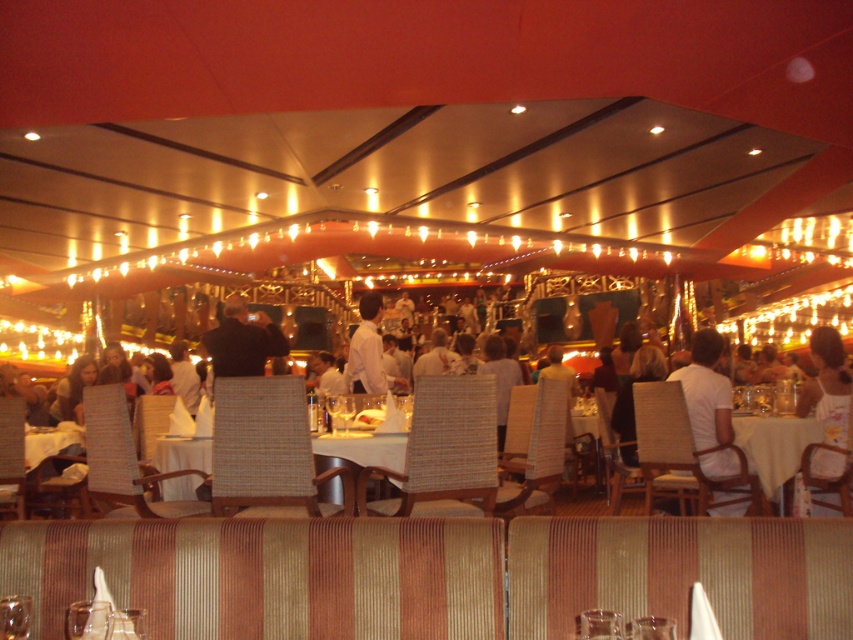
Question: Which object is positioned farthest from the white woven table at center?

Choices:
 (A) white matte shirt at center
 (B) yellow fabric table at center
 (C) white floral dress at center
 (D) white shirt at center

Answer: (C)

Question: Which point is closer to the camera taking this photo?

Choices:
 (A) (756, 444)
 (B) (160, 461)

Answer: (B)

Question: Is white shirt at center to the right of white woven table at center from the viewer's perspective?

Choices:
 (A) no
 (B) yes

Answer: (A)

Question: Which of these objects is positioned closest to the yellow fabric table at center?

Choices:
 (A) white matte shirt at center
 (B) white floral dress at center

Answer: (B)

Question: Can you confirm if white floral dress at center is positioned to the left of white shirt at center?

Choices:
 (A) yes
 (B) no

Answer: (B)

Question: Is white floral dress at center to the left of white shirt at center from the viewer's perspective?

Choices:
 (A) no
 (B) yes

Answer: (A)